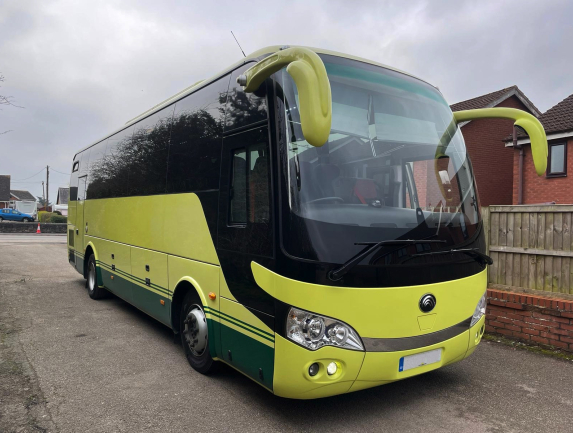
Where is `mirrors`? This screenshot has height=433, width=573. mirrors is located at coordinates (320, 124), (541, 141).